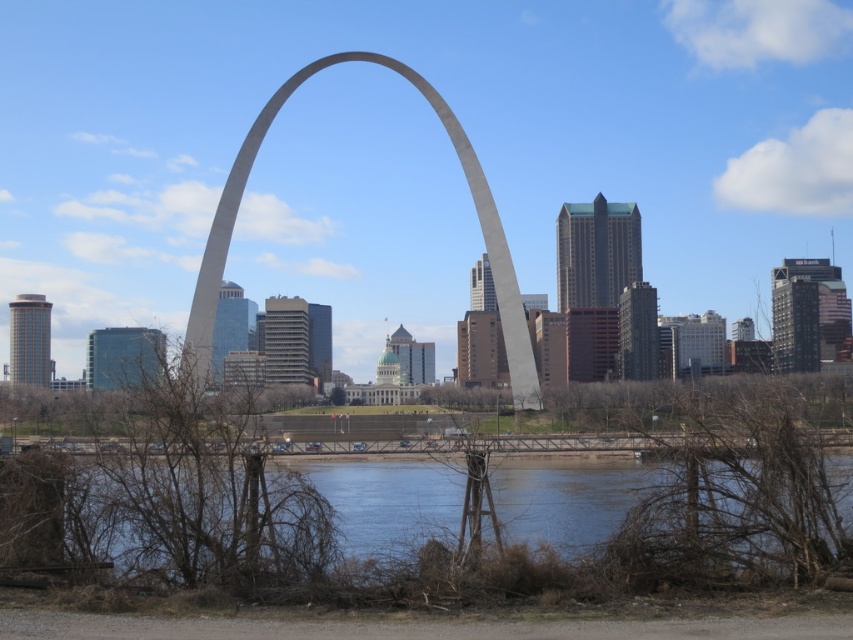
Question: Which point is farther to the camera?

Choices:
 (A) (509, 288)
 (B) (637, 481)

Answer: (B)

Question: Considering the relative positions of clear water at lower center and gray concrete arch at center in the image provided, where is clear water at lower center located with respect to gray concrete arch at center?

Choices:
 (A) left
 (B) right

Answer: (B)

Question: Which point appears closest to the camera in this image?

Choices:
 (A) (265, 112)
 (B) (561, 484)

Answer: (B)

Question: Which object appears farthest from the camera in this image?

Choices:
 (A) gray concrete arch at center
 (B) clear water at lower center

Answer: (A)

Question: Can you confirm if clear water at lower center is positioned to the left of gray concrete arch at center?

Choices:
 (A) no
 (B) yes

Answer: (A)

Question: Considering the relative positions of clear water at lower center and gray concrete arch at center in the image provided, where is clear water at lower center located with respect to gray concrete arch at center?

Choices:
 (A) right
 (B) left

Answer: (A)